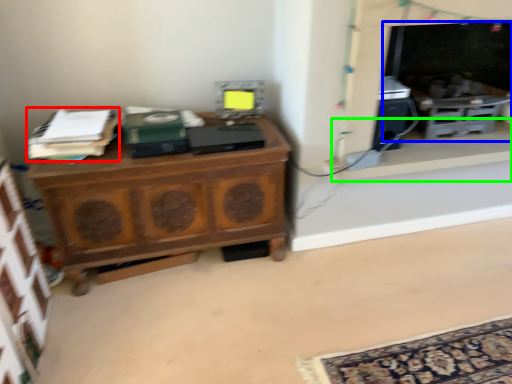
Question: Considering the real-world distances, which object is closest to book (highlighted by a red box)? fireplace (highlighted by a blue box) or window sill (highlighted by a green box).

Choices:
 (A) fireplace
 (B) window sill

Answer: (B)